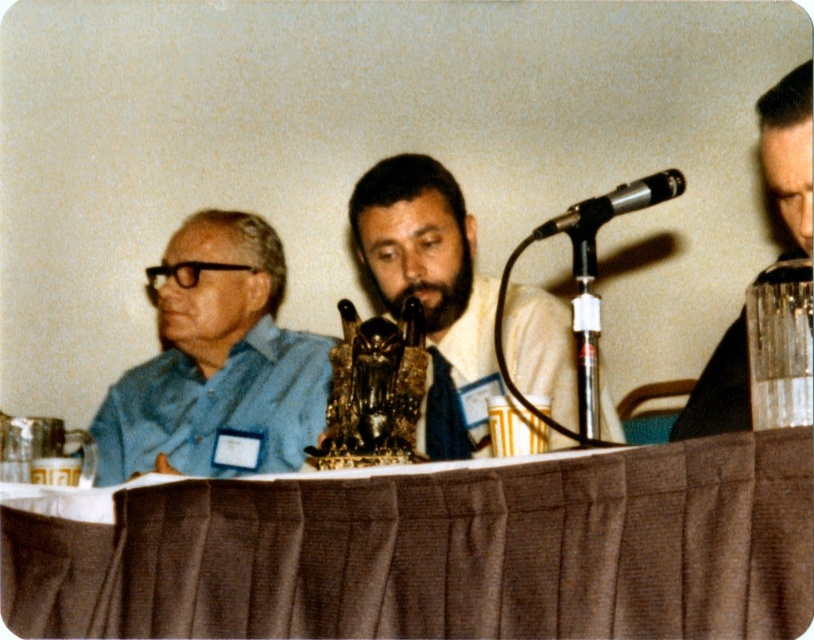
You are standing in front of the table where the three individuals are seated. There are two points marked on the table surface. One is at coordinates point [235,474] and the other at point [794,176]. Which of these points is closer to you?

Point [235,474] is closer to you because it is further to the viewer than point [794,176].

You are a photographer taking a picture of the scene. The blue matte shirt at left and the clear plastic glass at right are both in the frame. Which object should you focus on first if you want to ensure both are in focus, considering their heights?

The blue matte shirt at left is taller than the clear plastic glass at right, so you should focus on the blue matte shirt at left first to ensure both are in focus.

You are a photographer at a conference event. You need to position a camera to capture both the matte gold statue at center and the clear plastic glass at right in the same frame. Based on their positions, which object should be placed closer to the camera to ensure both are in focus?

The matte gold statue at center is in front of the clear plastic glass at right, so to ensure both are in focus, the statue should be closer to the camera since it is already positioned in front of the glass.